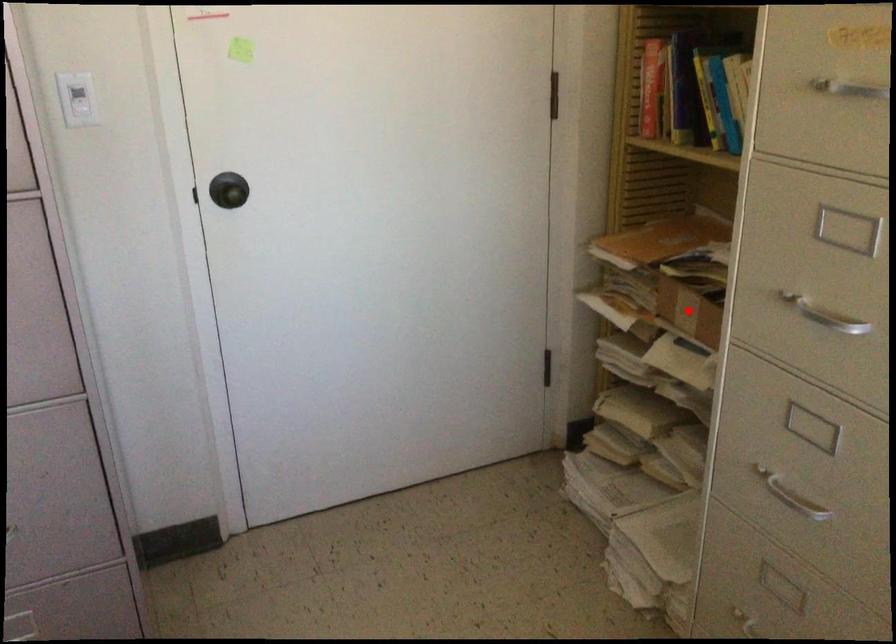
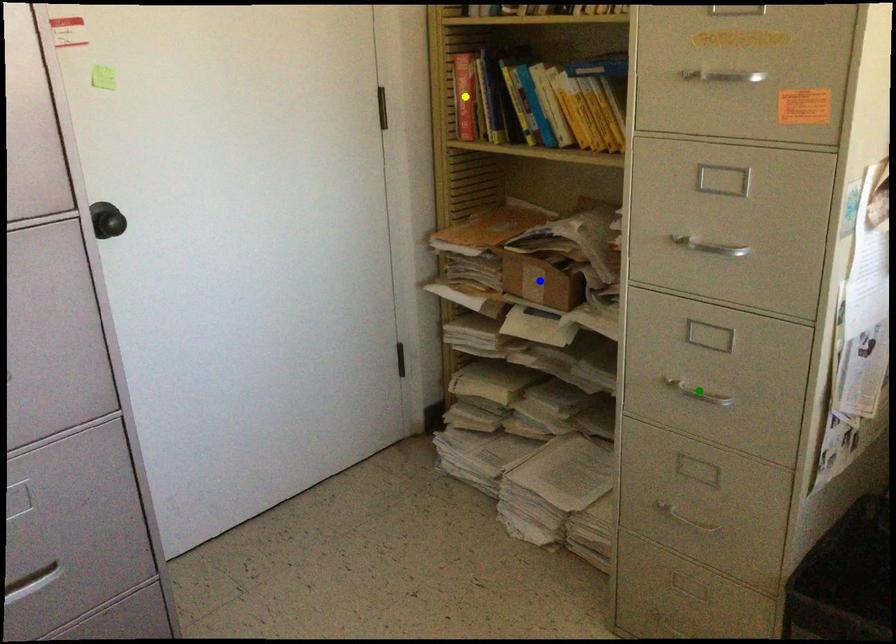
Question: I am providing you with two images of the same scene from different viewpoints. A red point is marked on the first image. You are given multiple points on the second image. In image 2, which mark is for the same physical point as the one in image 1?

Choices:
 (A) green point
 (B) yellow point
 (C) blue point

Answer: (C)